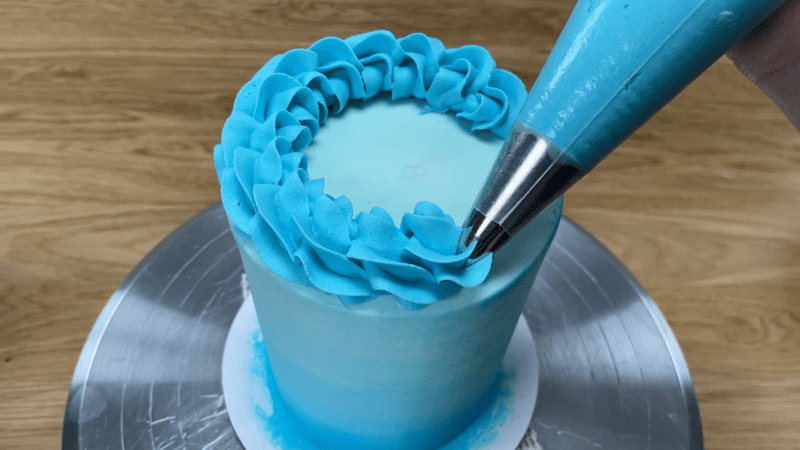
Where is `grey round dish`? The height and width of the screenshot is (450, 800). grey round dish is located at coordinates (161, 373).